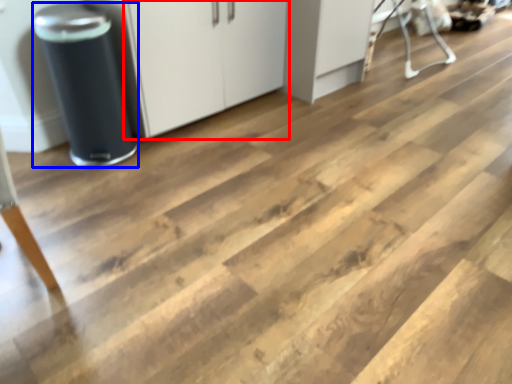
Question: Which object is further to the camera taking this photo, cabinetry (highlighted by a red box) or appliance (highlighted by a blue box)?

Choices:
 (A) cabinetry
 (B) appliance

Answer: (A)